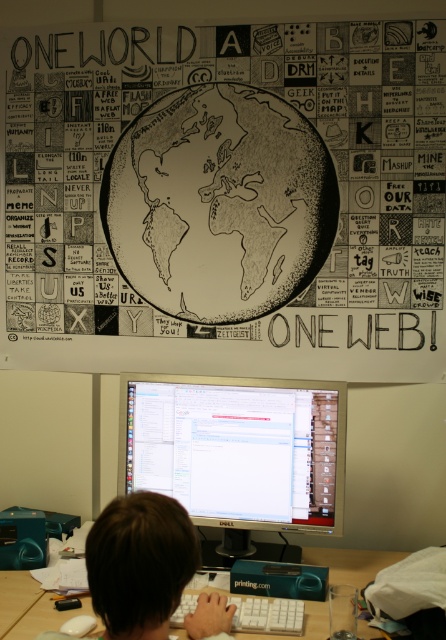
Can you confirm if brown hair at center is positioned above wooden at lower center?

Yes, brown hair at center is above wooden at lower center.

This screenshot has width=446, height=640. Describe the element at coordinates (140, 563) in the screenshot. I see `brown hair at center` at that location.

This screenshot has height=640, width=446. What do you see at coordinates (140, 563) in the screenshot?
I see `brown hair at center` at bounding box center [140, 563].

Locate an element on the screen. The image size is (446, 640). brown hair at center is located at coordinates (140, 563).

What do you see at coordinates (236, 451) in the screenshot?
I see `silver metallic monitor at center` at bounding box center [236, 451].

Can you confirm if silver metallic monitor at center is shorter than white plastic keyboard at center?

No, silver metallic monitor at center is not shorter than white plastic keyboard at center.

Is point (294, 380) positioned before point (264, 625)?

No, it is behind (264, 625).

The width and height of the screenshot is (446, 640). Find the location of `silver metallic monitor at center`. silver metallic monitor at center is located at coordinates (236, 451).

Which is in front, point (409, 284) or point (256, 484)?

Point (256, 484)

Can you confirm if black and white drawing of earth at upper center is positioned below silver metallic monitor at center?

Incorrect, black and white drawing of earth at upper center is not positioned below silver metallic monitor at center.

Is point (371, 240) positioned behind point (281, 516)?

That is True.

You are a GUI agent. You are given a task and a screenshot of the screen. Output one action in this format:
    pyautogui.click(x=<x>, y=<y>)
    Task: Click on the black and white drawing of earth at upper center
    
    Given the screenshot: What is the action you would take?
    pyautogui.click(x=224, y=198)